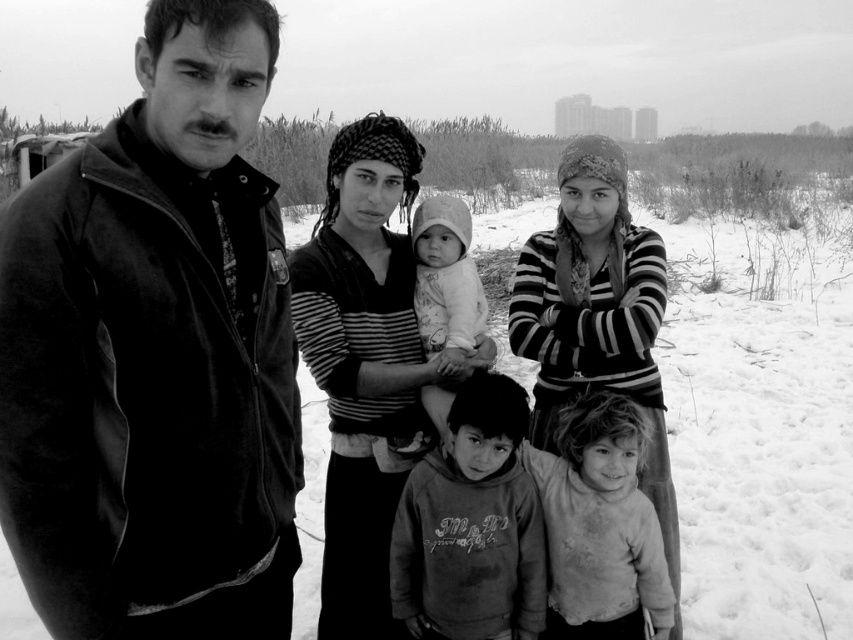
Does velvet black jacket at left appear on the left side of striped knit sweater at center?

Yes, velvet black jacket at left is to the left of striped knit sweater at center.

Is velvet black jacket at left bigger than striped knit sweater at center?

No, velvet black jacket at left is not bigger than striped knit sweater at center.

Is point (283, 324) farther from viewer compared to point (554, 337)?

That is False.

What are the coordinates of `velvet black jacket at left` in the screenshot? It's located at click(x=155, y=355).

Which is behind, point (602, 161) or point (506, 522)?

Positioned behind is point (602, 161).

Consider the image. Which is above, striped knit sweater at center or dirty gray sweatshirt at center?

striped knit sweater at center is higher up.

Which is in front, point (663, 426) or point (480, 596)?

Positioned in front is point (480, 596).

Find the location of a particular element. striped knit sweater at center is located at coordinates (596, 316).

Does velvet black jacket at left come in front of dirty gray sweatshirt at center?

Yes.

Describe the element at coordinates (155, 355) in the screenshot. This screenshot has height=640, width=853. I see `velvet black jacket at left` at that location.

Which is behind, point (97, 314) or point (483, 522)?

Point (483, 522)

The height and width of the screenshot is (640, 853). Find the location of `velvet black jacket at left`. velvet black jacket at left is located at coordinates (155, 355).